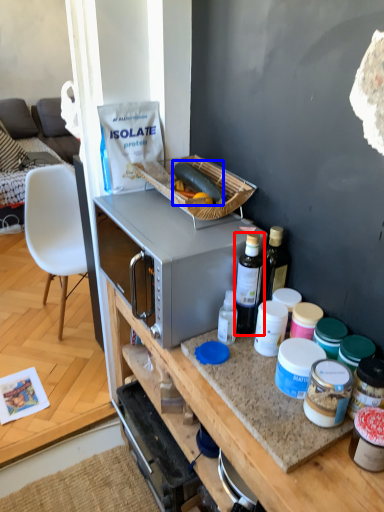
Question: Which point is further to the camera, bottle (highlighted by a red box) or food (highlighted by a blue box)?

Choices:
 (A) bottle
 (B) food

Answer: (B)